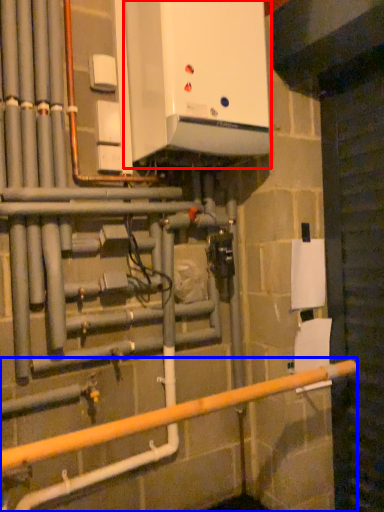
Question: Which object appears farthest to the camera in this image, home appliance (highlighted by a red box) or rail (highlighted by a blue box)?

Choices:
 (A) home appliance
 (B) rail

Answer: (A)